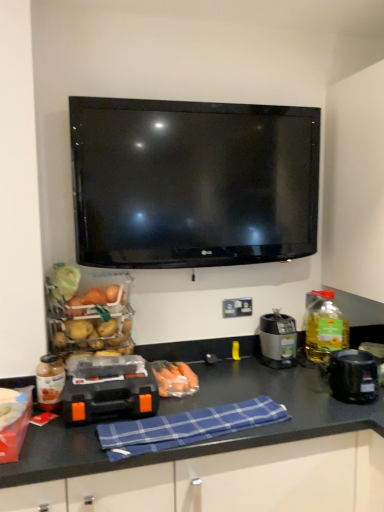
Find the location of `vacant space situated above translucent plastic carrots at center, the second food from the left (from a real-world perspective)`. vacant space situated above translucent plastic carrots at center, the second food from the left (from a real-world perspective) is located at coordinates (170, 368).